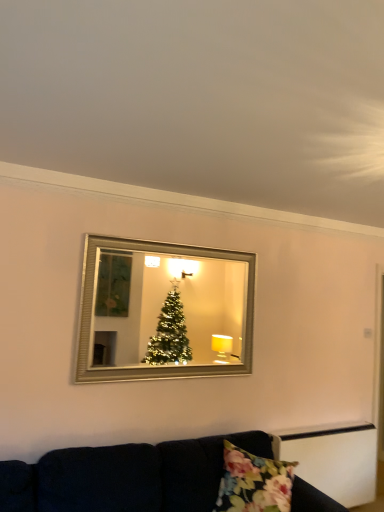
Question: Is floral fabric pillow at lower center shorter than silver/glass mirror at upper center?

Choices:
 (A) yes
 (B) no

Answer: (A)

Question: Is floral fabric pillow at lower center looking in the opposite direction of silver/glass mirror at upper center?

Choices:
 (A) yes
 (B) no

Answer: (B)

Question: Is floral fabric pillow at lower center facing towards silver/glass mirror at upper center?

Choices:
 (A) yes
 (B) no

Answer: (B)

Question: Is floral fabric pillow at lower center far from silver/glass mirror at upper center?

Choices:
 (A) no
 (B) yes

Answer: (B)

Question: Is floral fabric pillow at lower center further to the viewer compared to silver/glass mirror at upper center?

Choices:
 (A) yes
 (B) no

Answer: (B)

Question: Is floral fabric pillow at lower center wider than silver/glass mirror at upper center?

Choices:
 (A) no
 (B) yes

Answer: (B)

Question: Considering the relative sizes of silver/glass mirror at upper center and floral fabric pillow at lower center in the image provided, is silver/glass mirror at upper center thinner than floral fabric pillow at lower center?

Choices:
 (A) no
 (B) yes

Answer: (B)

Question: Can floral fabric pillow at lower center be found inside silver/glass mirror at upper center?

Choices:
 (A) yes
 (B) no

Answer: (B)

Question: From the image's perspective, is silver/glass mirror at upper center under floral fabric pillow at lower center?

Choices:
 (A) yes
 (B) no

Answer: (B)

Question: Considering the relative sizes of silver/glass mirror at upper center and floral fabric pillow at lower center in the image provided, is silver/glass mirror at upper center shorter than floral fabric pillow at lower center?

Choices:
 (A) yes
 (B) no

Answer: (B)

Question: Can you confirm if silver/glass mirror at upper center is smaller than floral fabric pillow at lower center?

Choices:
 (A) no
 (B) yes

Answer: (B)

Question: Is silver/glass mirror at upper center far from floral fabric pillow at lower center?

Choices:
 (A) no
 (B) yes

Answer: (B)

Question: From the image's perspective, would you say floral fabric pillow at lower center is shown under velvet dark blue couch at lower center?

Choices:
 (A) yes
 (B) no

Answer: (B)